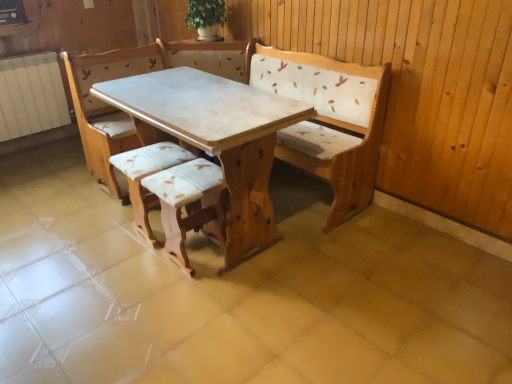
Locate an element on the screen. free space to the right of wooden armchair at center, which is the 2th armchair in left-to-right order is located at coordinates (258, 267).